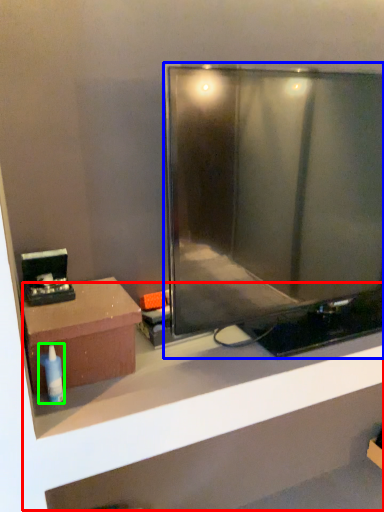
Question: Which is farther away from shelf (highlighted by a red box)? television (highlighted by a blue box) or toiletry (highlighted by a green box)?

Choices:
 (A) television
 (B) toiletry

Answer: (B)